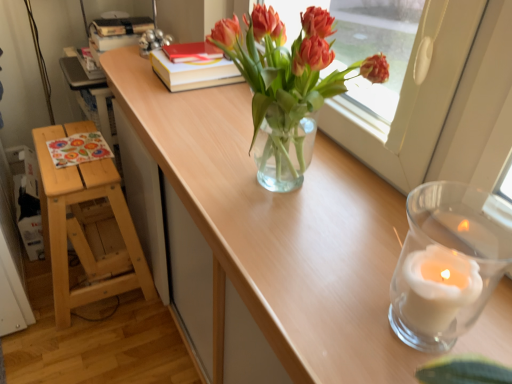
In the scene shown: In order to face clear wood table at center, should I rotate leftwards or rightwards?

Answer: It's best to rotate left around 3.918 degrees.

Identify the location of transparent glass candle at right. The image size is (512, 384). click(x=448, y=263).

Find the location of a particular element. translucent glass vase at center is located at coordinates (287, 83).

Measure the distance between point (x=273, y=71) and camera.

Point (x=273, y=71) is 27.56 inches from camera.

Describe the element at coordinates (88, 227) in the screenshot. The width and height of the screenshot is (512, 384). I see `natural wood stool at left` at that location.

Where is `clear wood table at center`? clear wood table at center is located at coordinates (279, 230).

From the image's perspective, is translucent glass vase at center located above transparent glass candle at right?

Yes.

Is translucent glass vase at center positioned behind transparent glass candle at right?

That is False.

Could transparent glass candle at right be considered to be inside translucent glass vase at center?

No.

Considering the sizes of objects red matte book at upper center, arranged as the second book when ordered from the bottom, and transparent glass candle at right in the image provided, who is wider, red matte book at upper center, arranged as the second book when ordered from the bottom, or transparent glass candle at right?

Wider between the two is red matte book at upper center, arranged as the second book when ordered from the bottom.

Could you tell me if red matte book at upper center, arranged as the second book when ordered from the bottom, is facing transparent glass candle at right?

No, red matte book at upper center, arranged as the second book when ordered from the bottom, is not oriented towards transparent glass candle at right.

Which of these two, red matte book at upper center, arranged as the second book when ordered from the bottom, or transparent glass candle at right, stands shorter?

Standing shorter between the two is red matte book at upper center, arranged as the second book when ordered from the bottom.

Between natural wood stool at left and metallic silver table lamp at upper left, which one appears on the right side from the viewer's perspective?

metallic silver table lamp at upper left.

From the image's perspective, does natural wood stool at left appear higher than metallic silver table lamp at upper left?

No, from the image's perspective, natural wood stool at left is not on top of metallic silver table lamp at upper left.

Considering the relative sizes of natural wood stool at left and metallic silver table lamp at upper left in the image provided, is natural wood stool at left taller than metallic silver table lamp at upper left?

Indeed, natural wood stool at left has a greater height compared to metallic silver table lamp at upper left.

Is natural wood stool at left wider or thinner than metallic silver table lamp at upper left?

natural wood stool at left is wider than metallic silver table lamp at upper left.

From the image's perspective, is transparent glass candle at right positioned above or below natural wood stool at left?

From the image's perspective, transparent glass candle at right appears below natural wood stool at left.

This screenshot has height=384, width=512. In order to click on candle holder below the natural wood stool at left (from the image's perspective) in this screenshot , I will do `click(448, 263)`.

How many degrees apart are the facing directions of transparent glass candle at right and natural wood stool at left?

transparent glass candle at right and natural wood stool at left are facing 0.000703 degrees away from each other.

Can you confirm if clear wood table at center is wider than red matte book at upper center, the first book from the top?

Yes.

From the image's perspective, is clear wood table at center located above red matte book at upper center, arranged as the second book when ordered from the bottom?

No.

Can you confirm if clear wood table at center is taller than red matte book at upper center, arranged as the second book when ordered from the bottom?

Correct, clear wood table at center is much taller as red matte book at upper center, arranged as the second book when ordered from the bottom.

From the image's perspective, is natural wood stool at left above transparent glass candle at right?

Yes, from the image's perspective, natural wood stool at left is over transparent glass candle at right.

Would you say natural wood stool at left is inside or outside transparent glass candle at right?

natural wood stool at left is outside transparent glass candle at right.

Which is closer, (44,161) or (433,329)?

Point (44,161) is farther from the camera than point (433,329).

Between point (415, 292) and point (167, 45), which one is positioned in front?

The point (415, 292) is more forward.

Considering the sizes of objects transparent glass candle at right and metallic silver table lamp at upper left in the image provided, who is wider, transparent glass candle at right or metallic silver table lamp at upper left?

Wider between the two is metallic silver table lamp at upper left.

Is transparent glass candle at right situated inside metallic silver table lamp at upper left or outside?

transparent glass candle at right lies outside metallic silver table lamp at upper left.

Image resolution: width=512 pixels, height=384 pixels. I want to click on houseplant in front of the transparent glass candle at right, so click(x=287, y=83).

At what (x,y) coordinates should I click in order to perform the action: click on candle holder below the red matte book at upper center, arranged as the second book when ordered from the bottom (from the image's perspective). Please return your answer as a coordinate pair (x, y). The width and height of the screenshot is (512, 384). Looking at the image, I should click on coord(448,263).

Looking at the image, which one is located further to hardcover book at center, the second book positioned from the top, clear wood table at center or translucent glass vase at center?

The object further to hardcover book at center, the second book positioned from the top, is translucent glass vase at center.

Which object lies further to the anchor point metallic silver table lamp at upper left, clear wood table at center or red matte book at upper center, arranged as the second book when ordered from the bottom?

Based on the image, clear wood table at center appears to be further to metallic silver table lamp at upper left.

Which object lies further to the anchor point natural wood stool at left, hardcover book at center, marked as the 1th book in a bottom-to-top arrangement, or translucent glass vase at center?

The object further to natural wood stool at left is translucent glass vase at center.

Considering their positions, is hardcover book at center, marked as the 1th book in a bottom-to-top arrangement, positioned closer to clear wood table at center than transparent glass candle at right?

transparent glass candle at right is closer to clear wood table at center.

Based on their spatial positions, is hardcover book at center, marked as the 1th book in a bottom-to-top arrangement, or transparent glass candle at right closer to natural wood stool at left?

hardcover book at center, marked as the 1th book in a bottom-to-top arrangement, lies closer to natural wood stool at left than the other object.

Based on their spatial positions, is red matte book at upper center, arranged as the second book when ordered from the bottom, or transparent glass candle at right further from hardcover book at center, marked as the 1th book in a bottom-to-top arrangement?

Based on the image, transparent glass candle at right appears to be further to hardcover book at center, marked as the 1th book in a bottom-to-top arrangement.

Based on their spatial positions, is natural wood stool at left or translucent glass vase at center closer to clear wood table at center?

The object closer to clear wood table at center is translucent glass vase at center.

Which object lies further to the anchor point red matte book at upper center, the first book from the top, clear wood table at center or hardcover book at center, marked as the 1th book in a bottom-to-top arrangement?

Among the two, clear wood table at center is located further to red matte book at upper center, the first book from the top.

Where is `houseplant located between clear wood table at center and natural wood stool at left in the depth direction`? The image size is (512, 384). houseplant located between clear wood table at center and natural wood stool at left in the depth direction is located at coordinates (287, 83).

The image size is (512, 384). What are the coordinates of `candle holder between clear wood table at center and hardcover book at center, the second book positioned from the top, along the z-axis` in the screenshot? It's located at (448, 263).

Identify the location of book between metallic silver table lamp at upper left and hardcover book at center, the second book positioned from the top, from top to bottom. The width and height of the screenshot is (512, 384). (191, 52).

Where is `table between metallic silver table lamp at upper left and transparent glass candle at right in the up-down direction`? The width and height of the screenshot is (512, 384). table between metallic silver table lamp at upper left and transparent glass candle at right in the up-down direction is located at coordinates (279, 230).